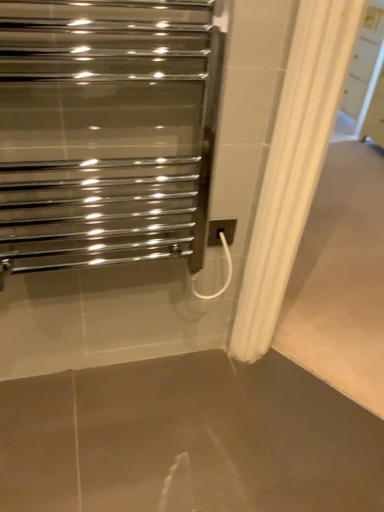
Where is `free point above brown polished concrete at center (from a real-world perspective)`? This screenshot has width=384, height=512. free point above brown polished concrete at center (from a real-world perspective) is located at coordinates (232, 409).